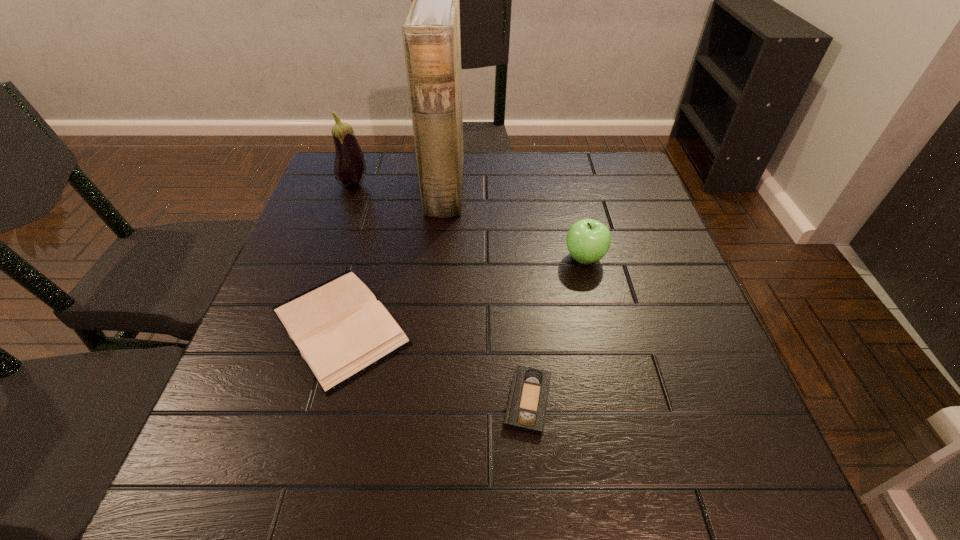
The height and width of the screenshot is (540, 960). Find the location of `the tallest object`. the tallest object is located at coordinates (431, 33).

Find the location of a particular element. eggplant is located at coordinates (349, 168).

Where is `the third shortest object`? The height and width of the screenshot is (540, 960). the third shortest object is located at coordinates (588, 240).

The image size is (960, 540). In order to click on apple in this screenshot , I will do `click(588, 240)`.

You are a GUI agent. You are given a task and a screenshot of the screen. Output one action in this format:
    pyautogui.click(x=<x>, y=<y>)
    Task: Click on the hardback book
    This screenshot has width=960, height=540.
    Given the screenshot: What is the action you would take?
    pyautogui.click(x=341, y=331)

Where is `the second object from right to left`? Image resolution: width=960 pixels, height=540 pixels. the second object from right to left is located at coordinates (526, 410).

Where is `videotape`? The width and height of the screenshot is (960, 540). videotape is located at coordinates (526, 410).

You are a GUI agent. You are given a task and a screenshot of the screen. Output one action in this format:
    pyautogui.click(x=<x>, y=<y>)
    Task: Click on the free location located on the cover of the phonebook
    The width and height of the screenshot is (960, 540).
    Given the screenshot: What is the action you would take?
    pyautogui.click(x=491, y=186)

Identify the location of vacant space located 0.070m on the front of the eggplant. This screenshot has width=960, height=540. (346, 210).

At what (x,y) coordinates should I click in order to perform the action: click on free spot located on the left of the apple. Please return your answer as a coordinate pair (x, y). The height and width of the screenshot is (540, 960). Looking at the image, I should click on (495, 258).